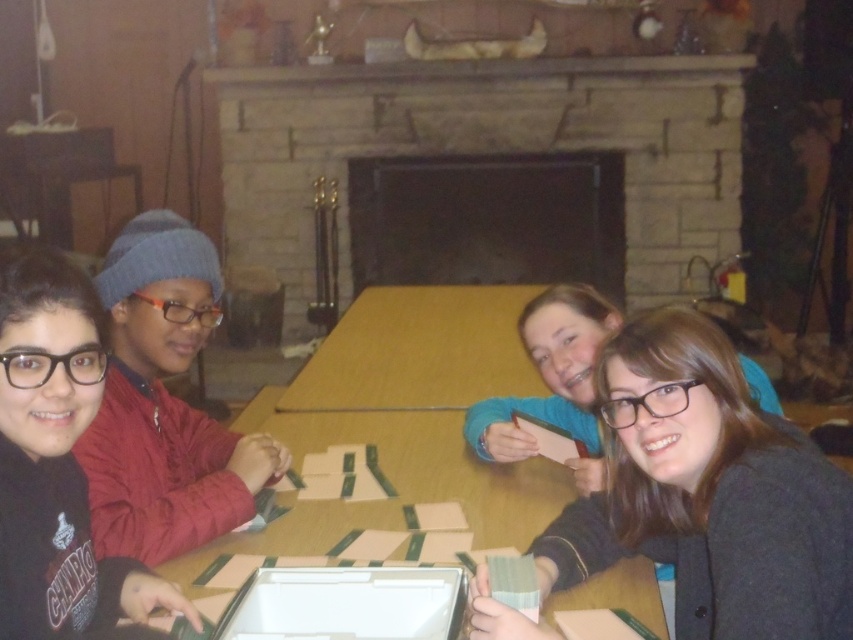
Question: Does stone fireplace at center appear over red fleece jacket at left?

Choices:
 (A) no
 (B) yes

Answer: (B)

Question: Which object is farther from the camera taking this photo?

Choices:
 (A) red fleece jacket at left
 (B) black matte beanie at left

Answer: (A)

Question: Which point is closer to the camera?

Choices:
 (A) (56, 364)
 (B) (679, 342)
 (C) (451, 388)

Answer: (A)

Question: Considering the real-world distances, which object is farthest from the dark gray fabric jacket at lower right?

Choices:
 (A) stone fireplace at center
 (B) brown wooden table at center
 (C) black matte beanie at left

Answer: (A)

Question: Is stone fireplace at center above black matte beanie at left?

Choices:
 (A) no
 (B) yes

Answer: (B)

Question: Is stone fireplace at center positioned behind black matte beanie at left?

Choices:
 (A) no
 (B) yes

Answer: (B)